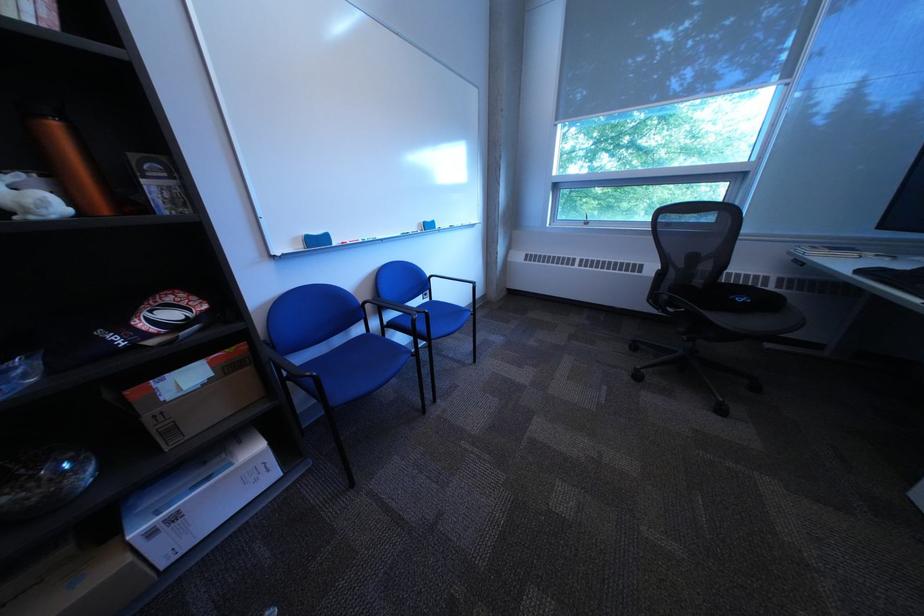
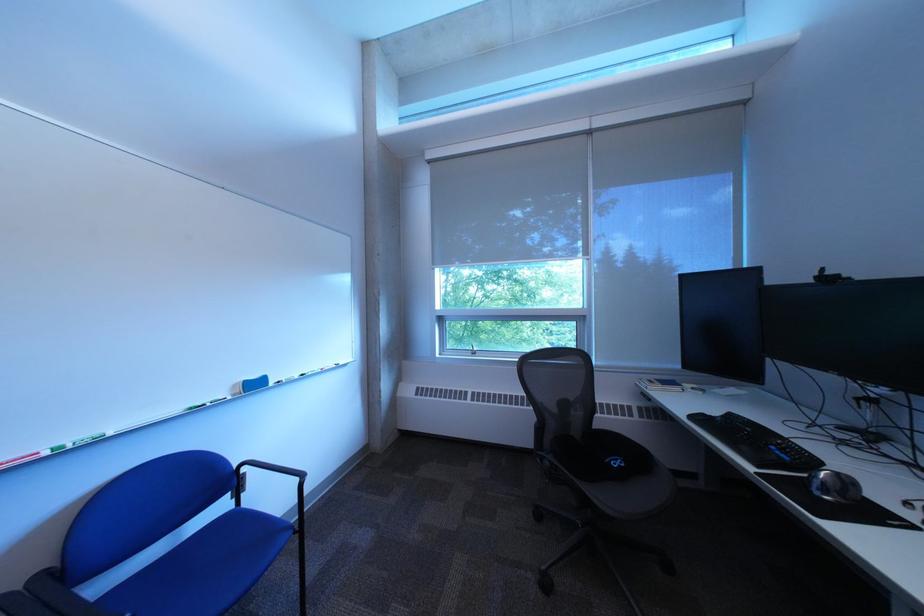
Locate, in the second image, the point that corresponds to point 681,299 in the first image.

(563, 464)